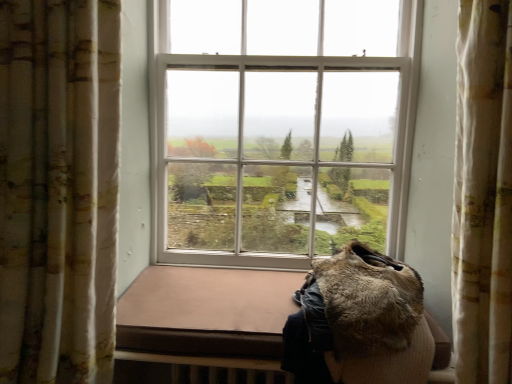
Question: Is fluffy fabric curtain at left at the back of furry brown coat at lower right?

Choices:
 (A) yes
 (B) no

Answer: (B)

Question: From the image's perspective, is furry brown coat at lower right below fluffy fabric curtain at left?

Choices:
 (A) yes
 (B) no

Answer: (A)

Question: Is furry brown coat at lower right positioned far away from fluffy fabric curtain at left?

Choices:
 (A) yes
 (B) no

Answer: (B)

Question: Is furry brown coat at lower right at the right side of fluffy fabric curtain at left?

Choices:
 (A) yes
 (B) no

Answer: (A)

Question: From a real-world perspective, is furry brown coat at lower right located beneath fluffy fabric curtain at left?

Choices:
 (A) yes
 (B) no

Answer: (A)

Question: Is furry brown coat at lower right taller than fluffy fabric curtain at left?

Choices:
 (A) yes
 (B) no

Answer: (B)

Question: From the image's perspective, would you say fluffy fabric curtain at left is positioned over furry brown coat at lower right?

Choices:
 (A) yes
 (B) no

Answer: (A)

Question: Could furry brown coat at lower right be considered to be inside fluffy fabric curtain at left?

Choices:
 (A) yes
 (B) no

Answer: (B)

Question: From a real-world perspective, does fluffy fabric curtain at left stand above furry brown coat at lower right?

Choices:
 (A) yes
 (B) no

Answer: (A)

Question: From the image's perspective, is fluffy fabric curtain at left located beneath furry brown coat at lower right?

Choices:
 (A) no
 (B) yes

Answer: (A)

Question: Is fluffy fabric curtain at left further to the viewer compared to furry brown coat at lower right?

Choices:
 (A) yes
 (B) no

Answer: (B)

Question: Is fluffy fabric curtain at left closer to camera compared to furry brown coat at lower right?

Choices:
 (A) no
 (B) yes

Answer: (B)

Question: Does point (292, 319) appear closer or farther from the camera than point (28, 193)?

Choices:
 (A) closer
 (B) farther

Answer: (B)